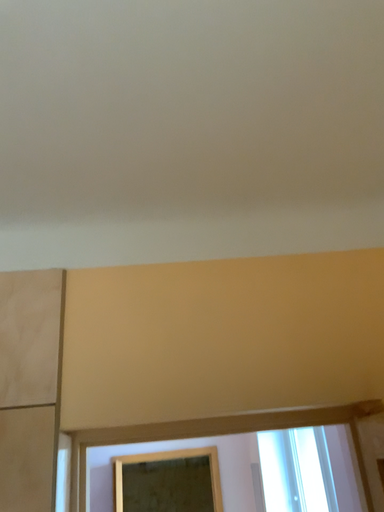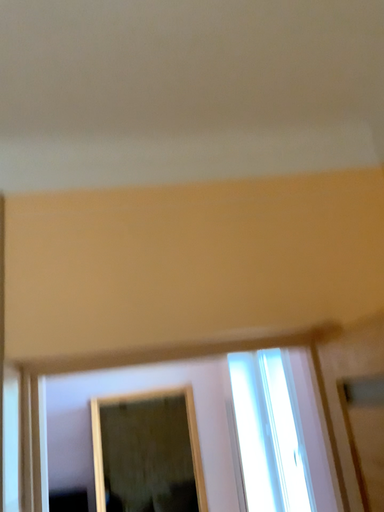
Question: Which way did the camera rotate in the video?

Choices:
 (A) rotated downward
 (B) rotated upward

Answer: (A)